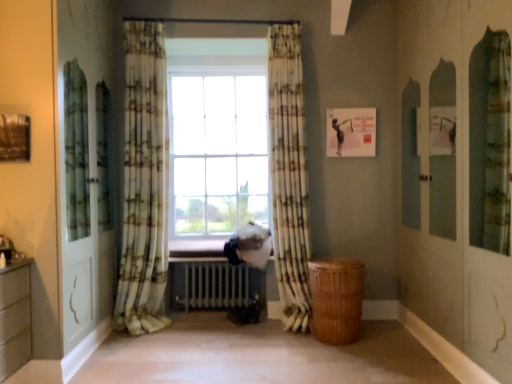
Question: From the image's perspective, is printed fabric curtain at center, which appears as the first curtain when viewed from the right, above or below printed fabric curtain at center, which appears as the 2th curtain when viewed from the right?

Choices:
 (A) above
 (B) below

Answer: (B)

Question: Looking at their shapes, would you say printed fabric curtain at center, which ranks as the 2th curtain in left-to-right order, is wider or thinner than printed fabric curtain at center, the 1th curtain when ordered from left to right?

Choices:
 (A) wide
 (B) thin

Answer: (A)

Question: Which object is the farthest from the printed fabric curtain at center, which appears as the first curtain when viewed from the right?

Choices:
 (A) printed fabric curtain at center, which appears as the 2th curtain when viewed from the right
 (B) white metallic radiator at center

Answer: (A)

Question: Estimate the real-world distances between objects in this image. Which object is closer to the white metallic radiator at center?

Choices:
 (A) printed fabric curtain at center, the 1th curtain when ordered from left to right
 (B) printed fabric curtain at center, which appears as the first curtain when viewed from the right

Answer: (A)